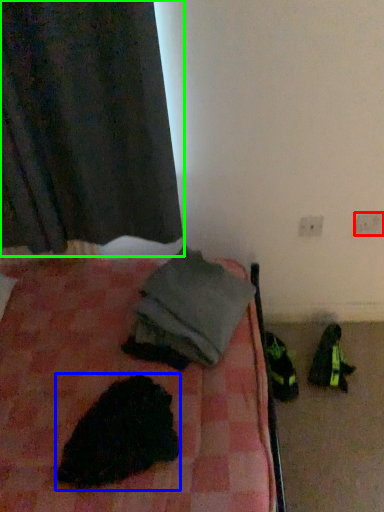
Question: Considering the real-world distances, which object is farthest from electric outlet (highlighted by a red box)? animal (highlighted by a blue box) or curtain (highlighted by a green box)?

Choices:
 (A) animal
 (B) curtain

Answer: (A)